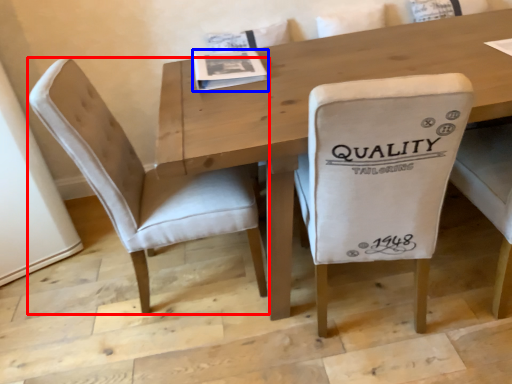
Question: Which point is closer to the camera, chair (highlighted by a red box) or magazine (highlighted by a blue box)?

Choices:
 (A) chair
 (B) magazine

Answer: (A)